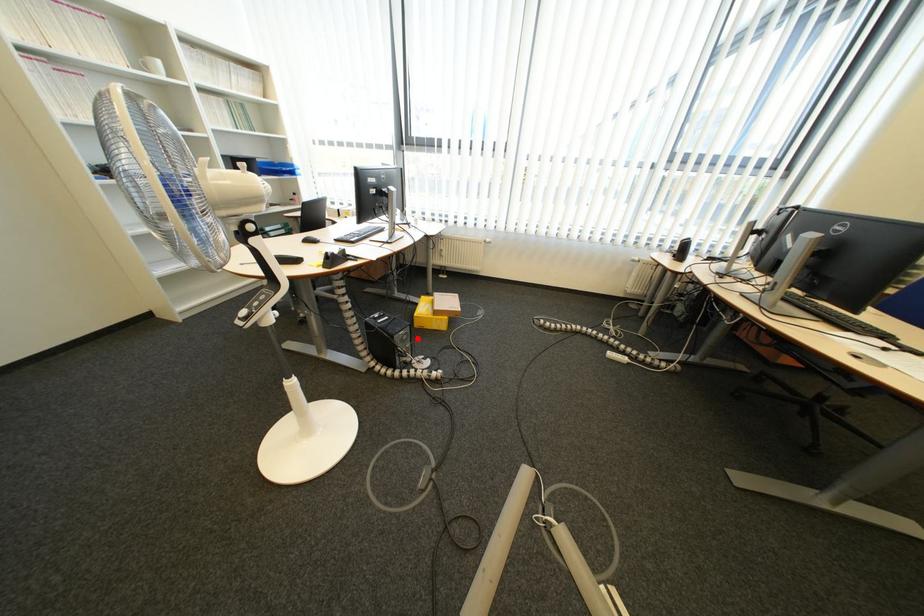
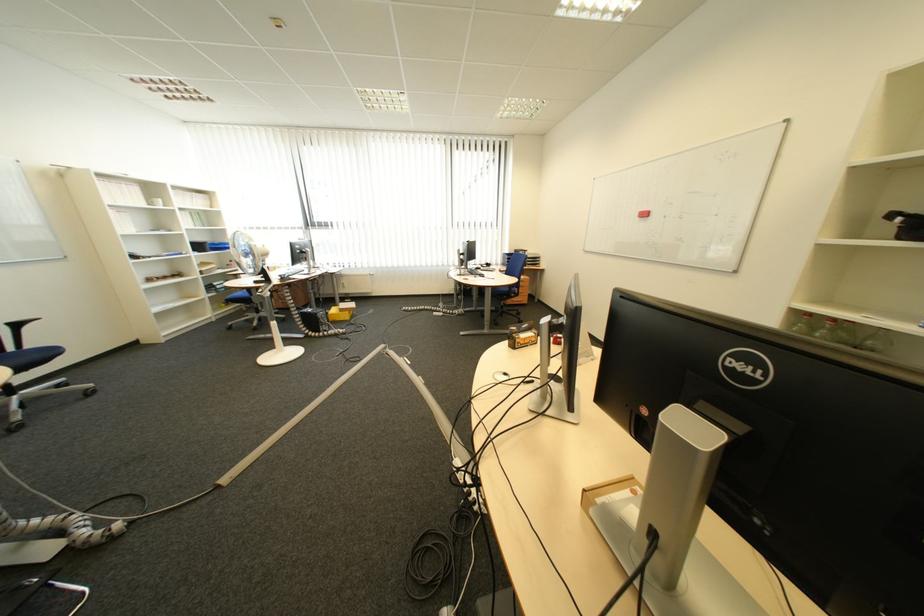
Question: I am providing you with two images of the same scene from different viewpoints. A red point is shown in image1. For the corresponding object point in image2, is it positioned nearer or farther from the camera?

Choices:
 (A) Nearer
 (B) Farther

Answer: (B)